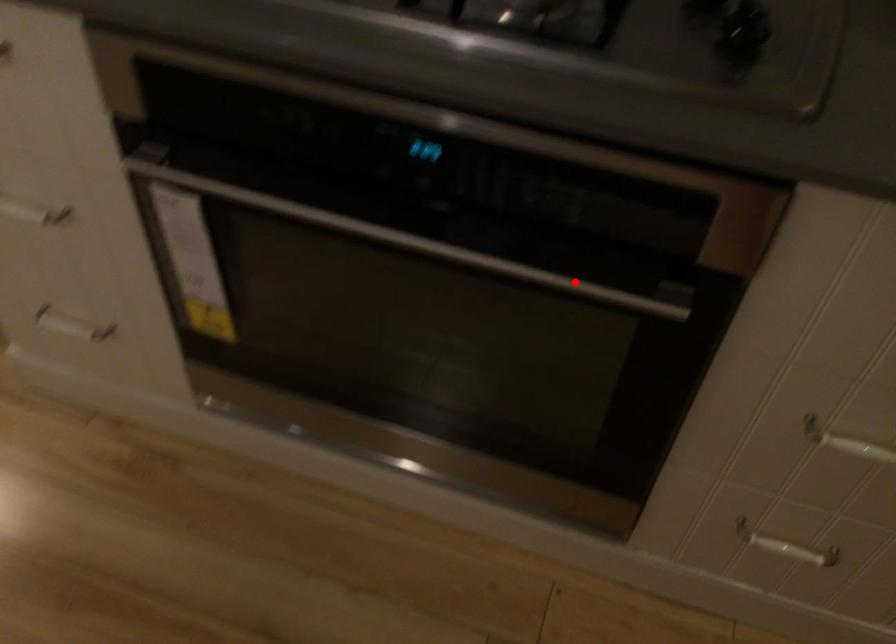
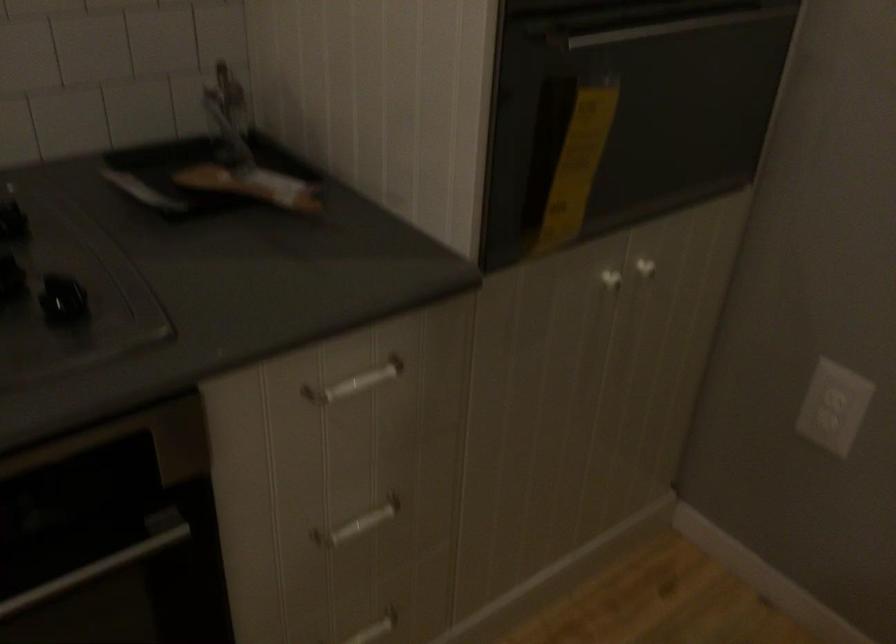
In the second image, find the point that corresponds to the highlighted location in the first image.

(97, 567)